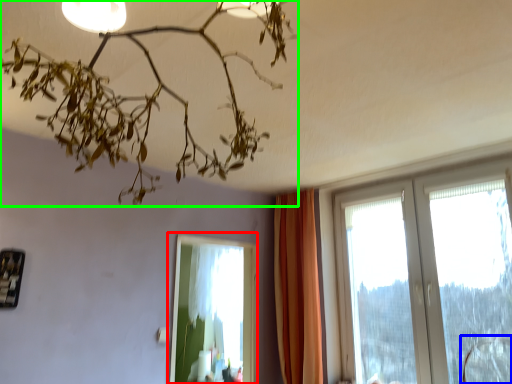
Question: Considering the real-world distances, which object is farthest from bay window (highlighted by a red box)? swivel chair (highlighted by a blue box) or lamp (highlighted by a green box)?

Choices:
 (A) swivel chair
 (B) lamp

Answer: (B)